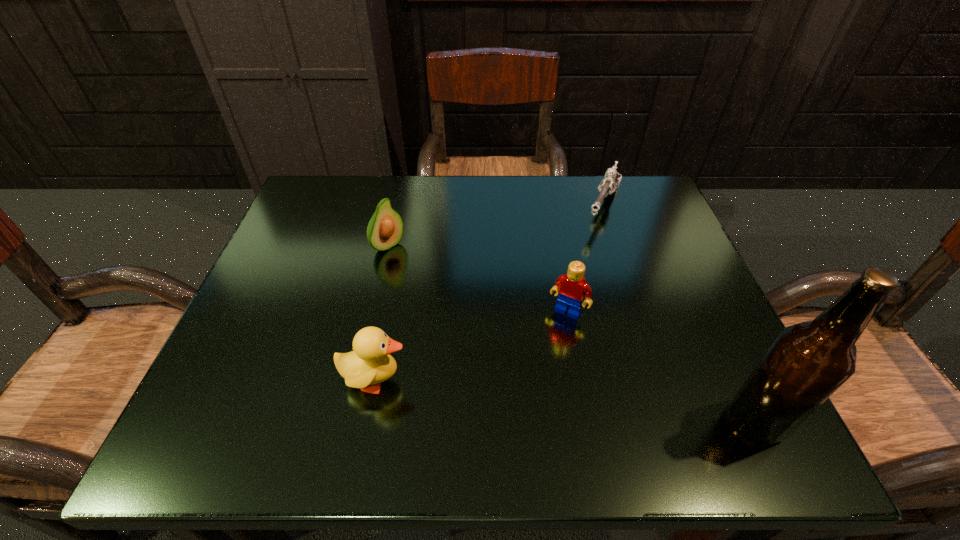
This screenshot has height=540, width=960. What are the coordinates of `duckling` in the screenshot? It's located at (370, 363).

I want to click on the tallest object, so click(809, 361).

Find the location of a particular element. Image resolution: width=960 pixels, height=540 pixels. beer bottle is located at coordinates (809, 361).

You are a GUI agent. You are given a task and a screenshot of the screen. Output one action in this format:
    pyautogui.click(x=<x>, y=<y>)
    Task: Click on the third object from left to right
    The height and width of the screenshot is (540, 960).
    Given the screenshot: What is the action you would take?
    pyautogui.click(x=572, y=288)

This screenshot has height=540, width=960. Identify the location of Lego. (572, 288).

What are the coordinates of `the second farthest object` in the screenshot? It's located at (385, 229).

Find the location of a particular element. This screenshot has width=960, height=540. the shortest object is located at coordinates (612, 178).

You are a GUI agent. You are given a task and a screenshot of the screen. Output one action in this format:
    pyautogui.click(x=<x>, y=<y>)
    Task: Click on the farthest object
    
    Given the screenshot: What is the action you would take?
    coord(612,178)

Locate an element on the screen. vacant space located 0.070m on the front-facing side of the duckling is located at coordinates (451, 380).

The image size is (960, 540). In order to click on blank space located 0.190m on the front-facing side of the third farthest object in this screenshot , I will do `click(515, 400)`.